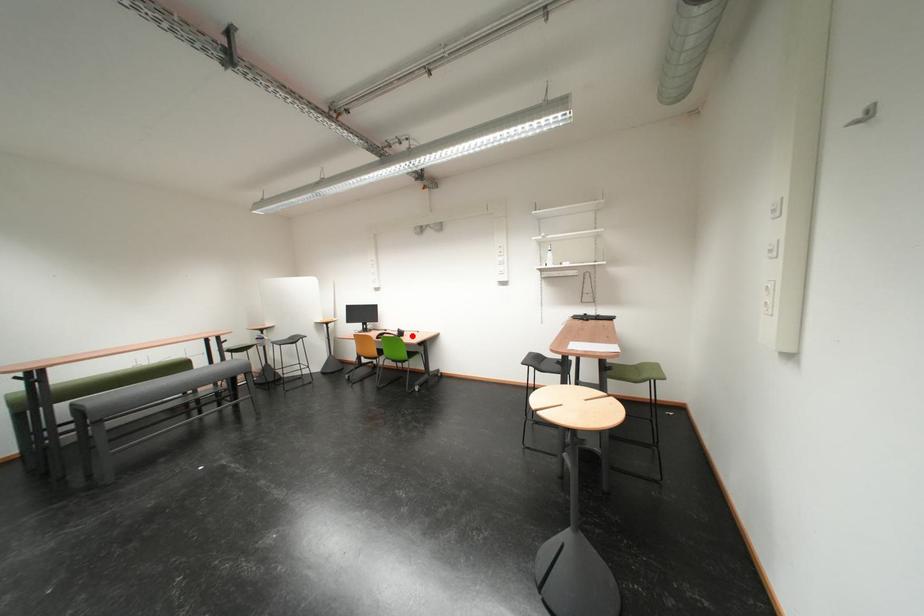
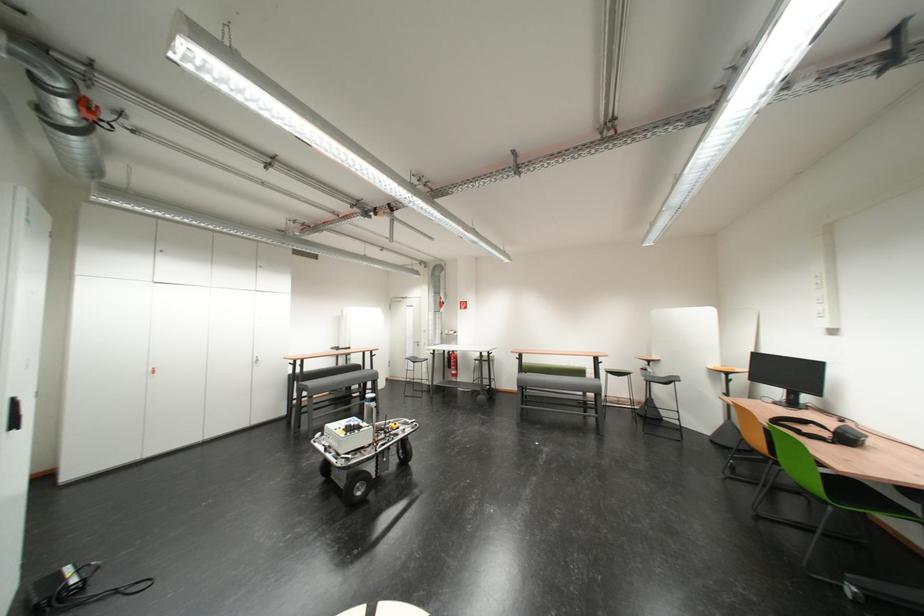
In the second image, find the point that corresponds to the highlighted location in the first image.

(858, 440)